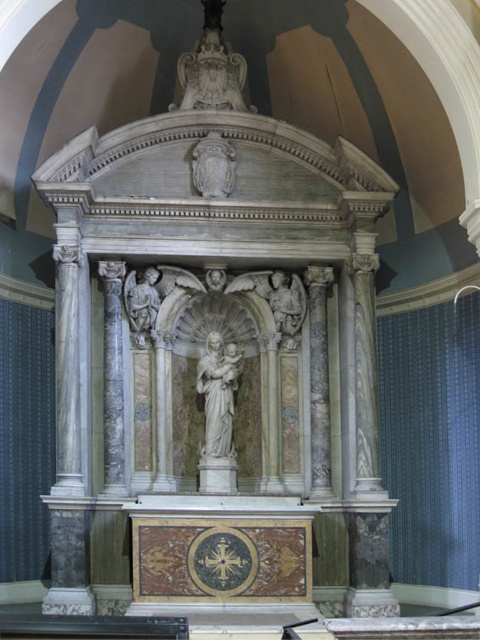
Who is positioned more to the right, white marble statue at upper center or white marble coat of arms at upper center?

From the viewer's perspective, white marble coat of arms at upper center appears more on the right side.

Does white marble statue at upper center have a greater width compared to white marble coat of arms at upper center?

Correct, the width of white marble statue at upper center exceeds that of white marble coat of arms at upper center.

The width and height of the screenshot is (480, 640). Identify the location of white marble statue at upper center. (212, 68).

Locate an element on the screen. This screenshot has height=640, width=480. white marble statue at upper center is located at coordinates (212, 68).

Which is in front, point (240, 356) or point (131, 308)?

Point (131, 308) is more forward.

Can you confirm if white marble statue at center is smaller than white marble angel at upper left?

Actually, white marble statue at center might be larger than white marble angel at upper left.

Identify the location of white marble statue at center. This screenshot has width=480, height=640. (217, 394).

You are a GUI agent. You are given a task and a screenshot of the screen. Output one action in this format:
    pyautogui.click(x=<x>, y=<y>)
    Task: Click on the white marble statue at center
    The image size is (480, 640).
    Given the screenshot: What is the action you would take?
    pyautogui.click(x=217, y=394)

In the scene shown: Is white marble statue at center wider than white marble coat of arms at upper center?

Yes.

Which is behind, point (218, 342) or point (204, 166)?

The point (204, 166) is more distant.

Locate an element on the screen. The image size is (480, 640). white marble statue at center is located at coordinates (217, 394).